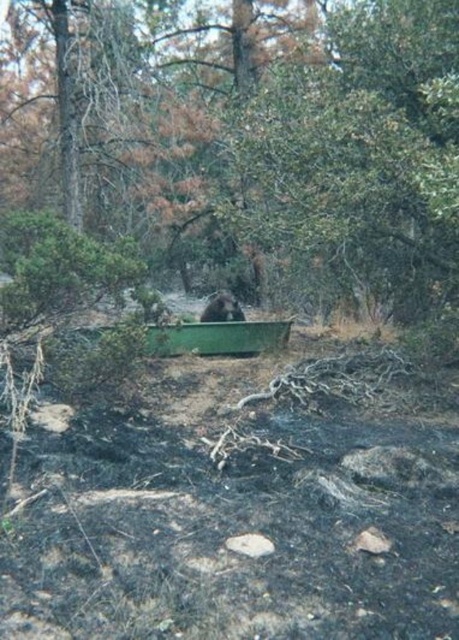
Question: Does green matte canoe at center have a greater width compared to brown furry bear at center?

Choices:
 (A) no
 (B) yes

Answer: (B)

Question: Is green matte canoe at center closer to the viewer compared to brown furry bear at center?

Choices:
 (A) no
 (B) yes

Answer: (B)

Question: Which object appears farthest from the camera in this image?

Choices:
 (A) brown furry bear at center
 (B) green matte canoe at center

Answer: (A)

Question: Is green matte canoe at center thinner than brown furry bear at center?

Choices:
 (A) yes
 (B) no

Answer: (B)

Question: Among these points, which one is farthest from the camera?

Choices:
 (A) (223, 300)
 (B) (205, 333)

Answer: (A)

Question: Which point is farther to the camera?

Choices:
 (A) (195, 342)
 (B) (212, 308)

Answer: (B)